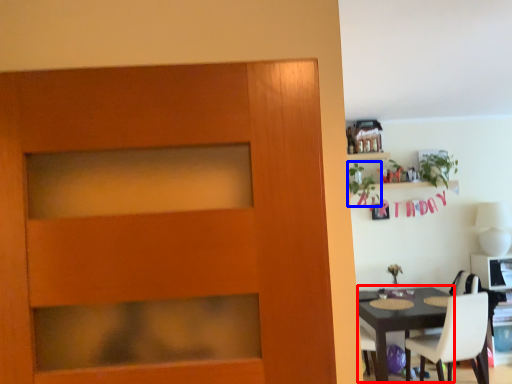
Question: Which object appears farthest to the camera in this image, round table (highlighted by a red box) or plant (highlighted by a blue box)?

Choices:
 (A) round table
 (B) plant

Answer: (B)